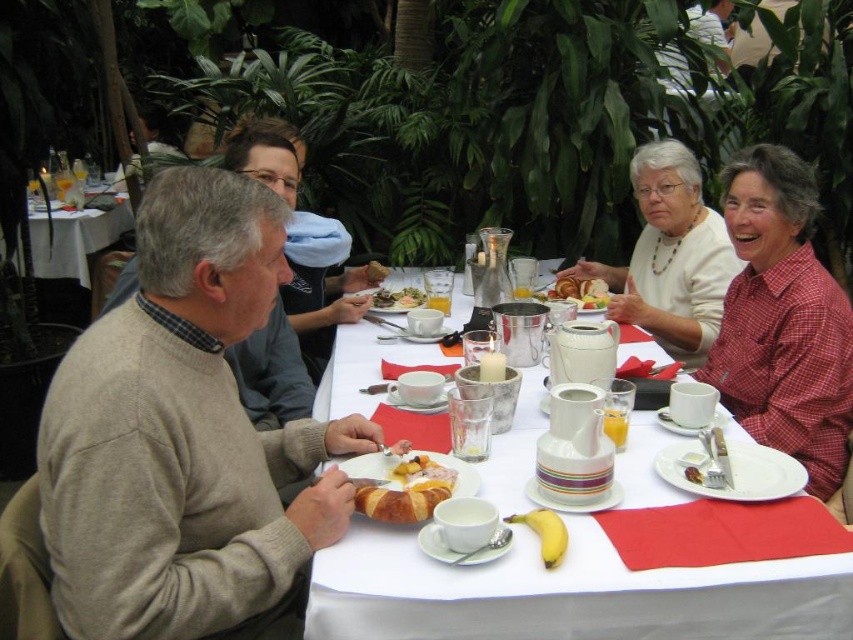
Is yellow smooth banana at lower center shorter than matte white plate at center?

Correct, yellow smooth banana at lower center is not as tall as matte white plate at center.

Does yellow smooth banana at lower center have a greater height compared to matte white plate at center?

No.

Locate an element on the screen. The image size is (853, 640). yellow smooth banana at lower center is located at coordinates (544, 532).

Who is taller, golden brown croissant at center or yellow smooth banana at lower center?

With more height is golden brown croissant at center.

Does golden brown croissant at center appear over yellow smooth banana at lower center?

Yes.

This screenshot has width=853, height=640. In order to click on golden brown croissant at center in this screenshot , I will do `click(407, 492)`.

At what (x,y) coordinates should I click in order to perform the action: click on golden brown croissant at center. Please return your answer as a coordinate pair (x, y). The image size is (853, 640). Looking at the image, I should click on (407, 492).

Who is positioned more to the right, light gray sweater at left or white matte sweater at upper right?

white matte sweater at upper right is more to the right.

Locate an element on the screen. light gray sweater at left is located at coordinates (183, 433).

Where is `light gray sweater at left`? The height and width of the screenshot is (640, 853). light gray sweater at left is located at coordinates (183, 433).